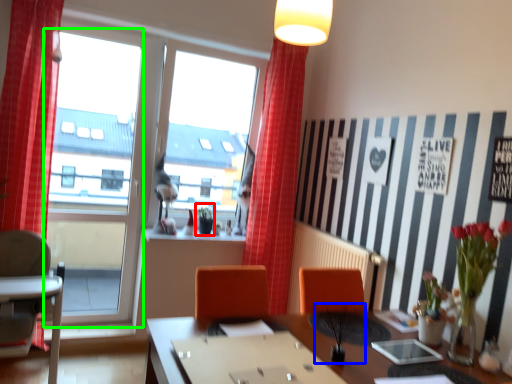
Question: Which is nearer to the plant (highlighted by a red box)? plant (highlighted by a blue box) or window frame (highlighted by a green box).

Choices:
 (A) plant
 (B) window frame

Answer: (B)